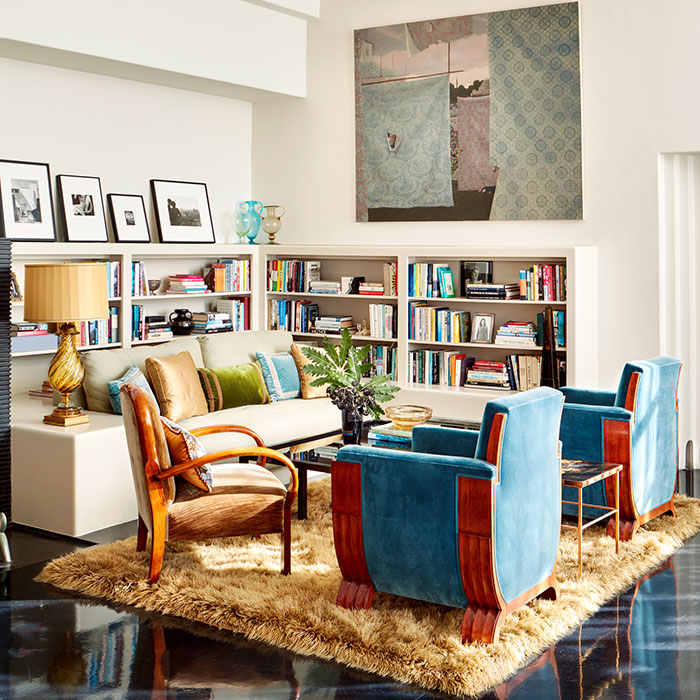
Find any where youd sit in the picture. Your answer should be formatted as a list of tuples, i.e. [(x1, y1), (x2, y2), ...], where each tuple contains the x and y coordinates of a point satisfying the conditions above.

[(199, 476), (460, 505), (603, 433), (242, 388), (148, 381)]